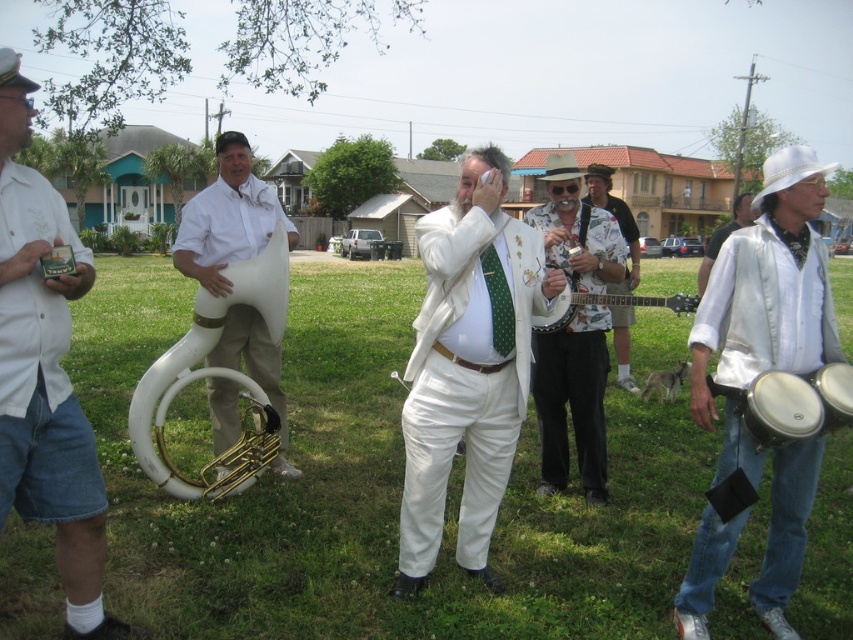
You are standing in the middle of the scene and want to move towards the two points marked in the image. Which point, point (401, 515) or point (252, 348), is closer to you?

Point (401, 515) is closer to the viewer than point (252, 348).

You are a photographer positioned at the center of the scene. You want to take a photo that includes both the white leather bongo at right and the white matte tuba at left. Which object should you adjust your position to focus on first to ensure both are in frame?

The white leather bongo at right is in front of the white matte tuba at left, so you should focus on the white leather bongo at right first to ensure both are visible in the frame.

You are a photographer standing at the edge of the grassy area. You need to capture a photo where both the white cotton shorts at left and the wooden banjo at center are visible. Based on their positions, which object should you adjust your camera angle to focus on first to ensure both are in frame?

Since the white cotton shorts at left is to the left of the wooden banjo at center, you should first focus on the white cotton shorts at left to ensure the entire left side of the frame includes it, then adjust to include the wooden banjo at center on the right side.